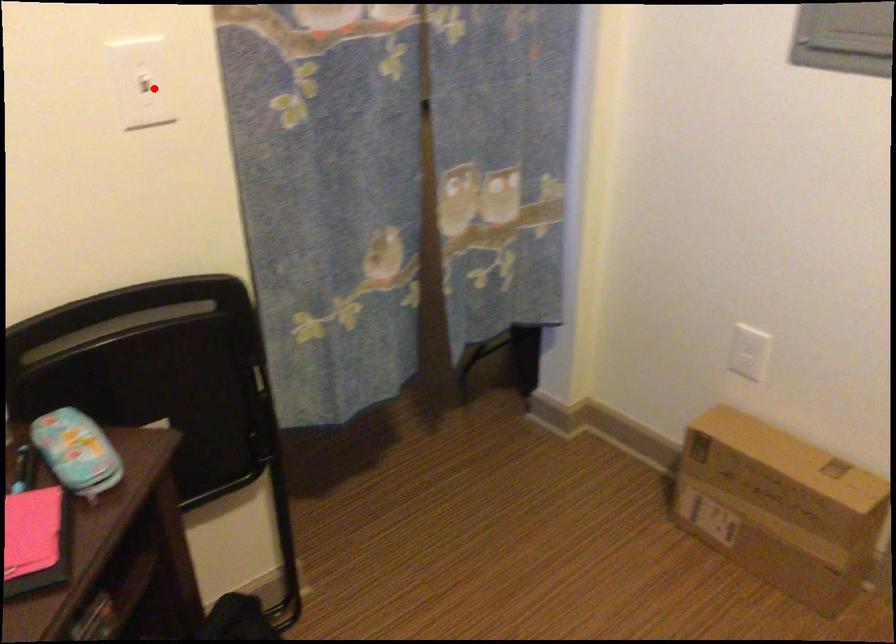
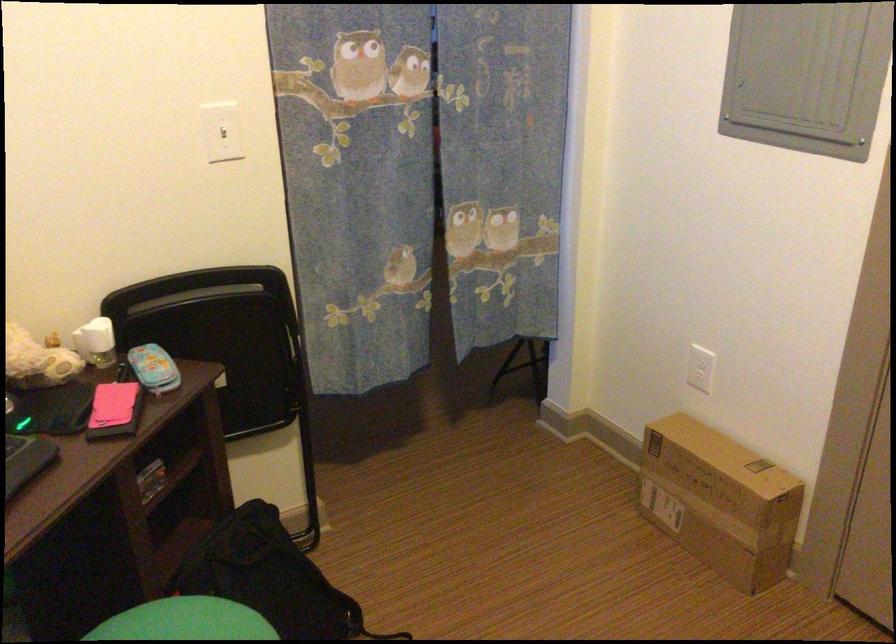
Where in the second image is the point corresponding to the highlighted location from the first image?

(222, 131)